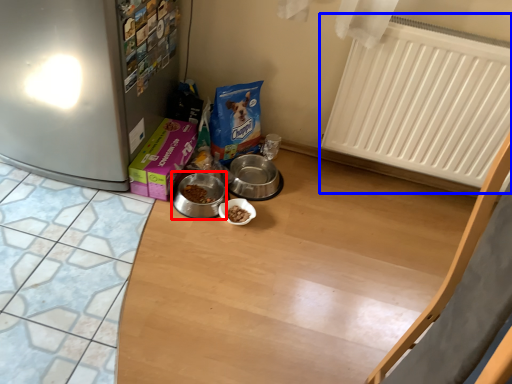
Question: Which object is closer to the camera taking this photo, appliance (highlighted by a red box) or radiator (highlighted by a blue box)?

Choices:
 (A) appliance
 (B) radiator

Answer: (B)